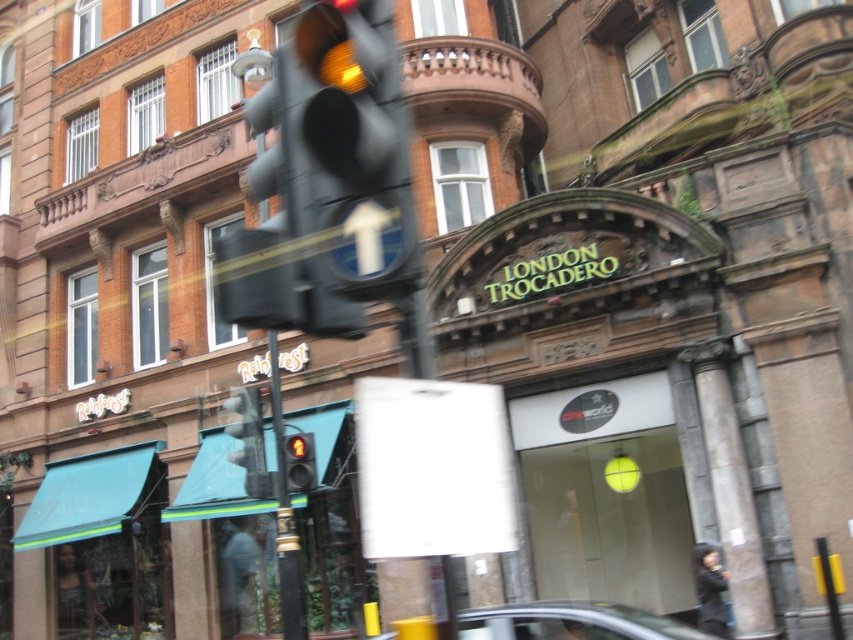
Question: Which point is closer to the camera?

Choices:
 (A) (306, 458)
 (B) (236, 460)

Answer: (A)

Question: Which point is farther to the camera?

Choices:
 (A) (279, 397)
 (B) (262, 445)
 (C) (593, 625)
 (D) (311, 452)

Answer: (B)

Question: Does metallic pole at center appear over yellow glass traffic light at center?

Choices:
 (A) no
 (B) yes

Answer: (A)

Question: Can you confirm if metallic pole at center is bigger than metallic traffic light at center?

Choices:
 (A) no
 (B) yes

Answer: (B)

Question: In this image, where is metallic pole at center located relative to yellow glass traffic light at center?

Choices:
 (A) below
 (B) above

Answer: (A)

Question: Estimate the real-world distances between objects in this image. Which object is farther from the metallic silver car at lower center?

Choices:
 (A) metallic pole at center
 (B) metallic traffic light at center

Answer: (B)